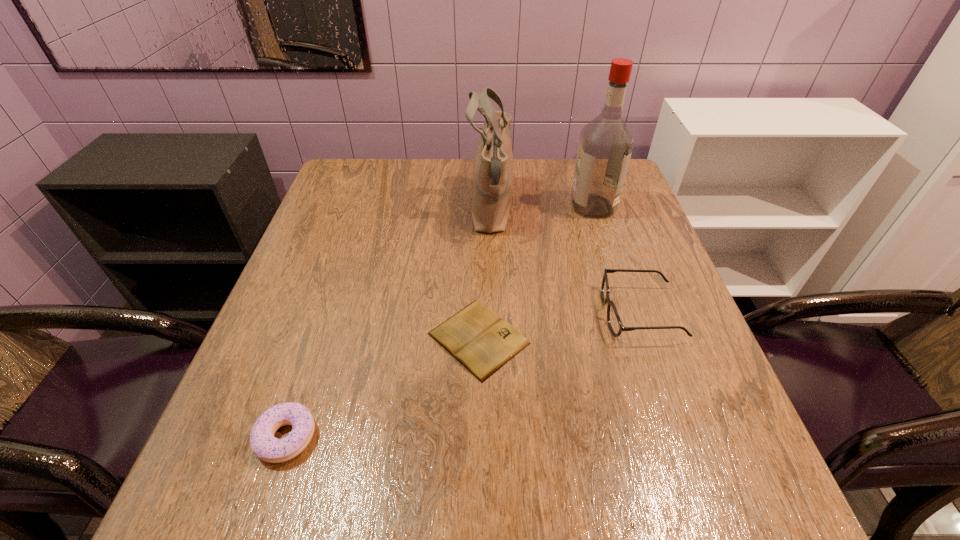
Identify the location of vacant space positioned 0.220m on the front-facing side of the fourth shortest object. (388, 210).

At what (x,y) coordinates should I click in order to perform the action: click on free space located on the front-facing side of the fourth shortest object. Please return your answer as a coordinate pair (x, y). Looking at the image, I should click on (417, 210).

Find the location of a particular element. The height and width of the screenshot is (540, 960). vacant space located on the front-facing side of the third shortest object is located at coordinates (490, 313).

You are a GUI agent. You are given a task and a screenshot of the screen. Output one action in this format:
    pyautogui.click(x=<x>, y=<y>)
    Task: Click on the vacant space located 0.070m on the front-facing side of the third shortest object
    This screenshot has height=540, width=960.
    Given the screenshot: What is the action you would take?
    pyautogui.click(x=569, y=313)

The height and width of the screenshot is (540, 960). I want to click on vacant point located 0.080m on the front-facing side of the third shortest object, so click(x=564, y=313).

Where is `vacant space located 0.170m on the back of the doughnut`? vacant space located 0.170m on the back of the doughnut is located at coordinates (321, 334).

At what (x,y) coordinates should I click in order to perform the action: click on free space located 0.270m on the left of the shortest object. Please return your answer as a coordinate pair (x, y). The image size is (960, 540). Looking at the image, I should click on (293, 339).

Locate an element on the screen. This screenshot has height=540, width=960. liquor at the far edge is located at coordinates (605, 146).

Image resolution: width=960 pixels, height=540 pixels. I want to click on shoulder bag that is at the far edge, so click(x=493, y=170).

You are a GUI agent. You are given a task and a screenshot of the screen. Output one action in this format:
    pyautogui.click(x=<x>, y=<y>)
    Task: Click on the object positioned at the left edge
    Image resolution: width=960 pixels, height=540 pixels.
    Given the screenshot: What is the action you would take?
    pyautogui.click(x=266, y=447)